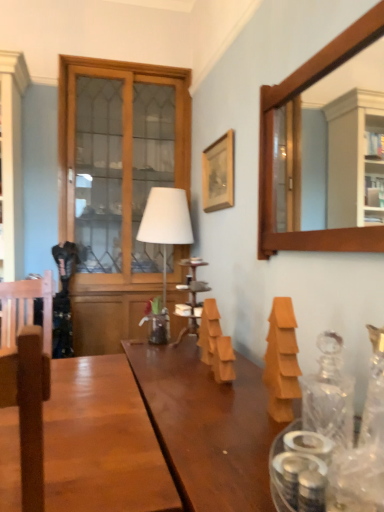
Where is `brown wood swivel chair at left`? This screenshot has width=384, height=512. brown wood swivel chair at left is located at coordinates [21, 330].

Find the location of a particular element. Image resolution: width=384 pixels, height=512 pixels. wooden frame mirror at upper right is located at coordinates (273, 142).

What is the approximate height of orange matte wooden blocks at center, the first wood positioned from the left?

orange matte wooden blocks at center, the first wood positioned from the left, is 9.26 inches in height.

This screenshot has height=512, width=384. What are the coordinates of `wooden cabinet with glass doors at left` in the screenshot? It's located at (119, 159).

What are the coordinates of `transparent glass decanter at right` in the screenshot? It's located at (329, 394).

Find the location of `brown wood swivel chair at left`. brown wood swivel chair at left is located at coordinates (21, 330).

Locate an element on the screen. the 1st wood in front when counting from the wooden cabinet with glass doors at left is located at coordinates (215, 344).

Does wooden cabinet with glass doors at left come behind orange matte wooden blocks at center, placed as the 1th wood when sorted from back to front?

Yes, it is.

From the image's perspective, would you say wooden cabinet with glass doors at left is shown under orange matte wooden blocks at center, the first wood positioned from the left?

Actually, wooden cabinet with glass doors at left appears above orange matte wooden blocks at center, the first wood positioned from the left, in the image.

Is point (64, 76) farther from viewer compared to point (229, 337)?

Yes, point (64, 76) is farther from viewer.

From a real-world perspective, is orange matte wooden blocks at center, the first wood positioned from the left, positioned under brown wood swivel chair at left based on gravity?

Incorrect, from a real-world perspective, orange matte wooden blocks at center, the first wood positioned from the left, is higher than brown wood swivel chair at left.

Between orange matte wooden blocks at center, placed as the 1th wood when sorted from back to front, and brown wood swivel chair at left, which one has more height?

brown wood swivel chair at left is taller.

Who is bigger, orange matte wooden blocks at center, acting as the 2th wood starting from the front, or brown wood swivel chair at left?

brown wood swivel chair at left is bigger.

Could brown wood swivel chair at left be considered to be inside orange matte wooden blocks at center, placed as the 1th wood when sorted from back to front?

No, brown wood swivel chair at left is located outside of orange matte wooden blocks at center, placed as the 1th wood when sorted from back to front.

Is point (213, 332) more distant than point (313, 415)?

Yes, it is behind point (313, 415).

Is orange matte wooden blocks at center, which is the 2th wood from right to left, further to camera compared to transparent glass decanter at right?

Yes, orange matte wooden blocks at center, which is the 2th wood from right to left, is behind transparent glass decanter at right.

In the scene shown: From the image's perspective, is orange matte wooden blocks at center, acting as the 2th wood starting from the front, over transparent glass decanter at right?

Yes, from the image's perspective, orange matte wooden blocks at center, acting as the 2th wood starting from the front, is over transparent glass decanter at right.

Considering the relative sizes of wooden cabinet with glass doors at left and transparent glass decanter at right in the image provided, is wooden cabinet with glass doors at left shorter than transparent glass decanter at right?

In fact, wooden cabinet with glass doors at left may be taller than transparent glass decanter at right.

Is wooden cabinet with glass doors at left positioned far away from transparent glass decanter at right?

Yes.

Does wooden cabinet with glass doors at left have a larger size compared to transparent glass decanter at right?

Yes, wooden cabinet with glass doors at left is bigger than transparent glass decanter at right.

Is white matte table lamp at center looking in the opposite direction of orange matte wooden blocks at center, placed as the 1th wood when sorted from back to front?

No.

Considering the relative positions of white matte table lamp at center and orange matte wooden blocks at center, acting as the 2th wood starting from the front, in the image provided, is white matte table lamp at center to the left or to the right of orange matte wooden blocks at center, acting as the 2th wood starting from the front,?

white matte table lamp at center is to the left of orange matte wooden blocks at center, acting as the 2th wood starting from the front.

Does point (149, 221) lie in front of point (228, 343)?

No.

Is white matte table lamp at center touching orange matte wooden blocks at center, the first wood positioned from the left?

No, white matte table lamp at center is not touching orange matte wooden blocks at center, the first wood positioned from the left.

Consider the image. Is clear glass vase at right facing away from orange matte wooden block at right, which appears as the 2th wood when viewed from the back?

clear glass vase at right does not have its back to orange matte wooden block at right, which appears as the 2th wood when viewed from the back.

From the image's perspective, which one is positioned higher, clear glass vase at right or orange matte wooden block at right, which ranks as the 1th wood in right-to-left order?

orange matte wooden block at right, which ranks as the 1th wood in right-to-left order, from the image's perspective.

Considering the relative positions of clear glass vase at right and orange matte wooden block at right, which appears as the 2th wood when viewed from the back, in the image provided, is clear glass vase at right behind orange matte wooden block at right, which appears as the 2th wood when viewed from the back,?

No, it is not.

What's the angular difference between clear glass vase at right and white matte table lamp at center's facing directions?

clear glass vase at right and white matte table lamp at center are facing 91.2 degrees away from each other.

Is clear glass vase at right placed right next to white matte table lamp at center?

clear glass vase at right and white matte table lamp at center are clearly separated.

Which is behind, point (377, 428) or point (172, 204)?

The point (172, 204) is behind.

Considering the relative positions of clear glass vase at right and white matte table lamp at center in the image provided, is clear glass vase at right to the left or to the right of white matte table lamp at center?

From the image, it's evident that clear glass vase at right is to the right of white matte table lamp at center.

Find the location of a particular element. window that is above the orange matte wooden blocks at center, which is the 2th wood from right to left (from the image's perspective) is located at coordinates (119, 159).

In order to click on swivel chair on the left of orange matte wooden blocks at center, which is the 2th wood from right to left in this screenshot , I will do `click(21, 330)`.

Which object lies nearer to the anchor point orange matte wooden blocks at center, placed as the 1th wood when sorted from back to front, brown wood swivel chair at left or clear glass vase at right?

Based on the image, clear glass vase at right appears to be nearer to orange matte wooden blocks at center, placed as the 1th wood when sorted from back to front.

From the picture: Based on their spatial positions, is orange matte wooden blocks at center, the first wood positioned from the left, or brown wood swivel chair at left closer to wooden cabinet with glass doors at left?

Among the two, brown wood swivel chair at left is located nearer to wooden cabinet with glass doors at left.

Based on their spatial positions, is orange matte wooden block at right, which ranks as the 1th wood in front-to-back order, or transparent glass decanter at right further from orange matte wooden blocks at center, which is the 2th wood from right to left?

transparent glass decanter at right lies further to orange matte wooden blocks at center, which is the 2th wood from right to left, than the other object.

Considering their positions, is transparent glass decanter at right positioned further to wooden picture frame at upper center than orange matte wooden blocks at center, acting as the 2th wood starting from the front?

transparent glass decanter at right.

Looking at the image, which one is located further to wooden frame mirror at upper right, wooden cabinet with glass doors at left or wooden picture frame at upper center?

wooden cabinet with glass doors at left.

From the image, which object appears to be farther from clear glass vase at right, brown wood swivel chair at left or wooden picture frame at upper center?

wooden picture frame at upper center.

Which object lies further to the anchor point orange matte wooden block at right, which appears as the 2th wood when viewed from the back, clear glass vase at right or orange matte wooden blocks at center, the first wood positioned from the left?

orange matte wooden blocks at center, the first wood positioned from the left.

From the image, which object appears to be nearer to wooden frame mirror at upper right, white matte table lamp at center or wooden picture frame at upper center?

The object closer to wooden frame mirror at upper right is wooden picture frame at upper center.

The image size is (384, 512). Identify the location of swivel chair between wooden frame mirror at upper right and wooden cabinet with glass doors at left in the front-back direction. (21, 330).

I want to click on glass jar between clear glass vase at right and white matte table lamp at center in the front-back direction, so click(x=329, y=394).

I want to click on wood between transparent glass decanter at right and orange matte wooden blocks at center, placed as the 1th wood when sorted from back to front, along the z-axis, so click(x=281, y=361).

You are a GUI agent. You are given a task and a screenshot of the screen. Output one action in this format:
    pyautogui.click(x=<x>, y=<y>)
    Task: Click on the glass jar located between clear glass vase at right and orange matte wooden block at right, which ranks as the 1th wood in right-to-left order, in the depth direction
    Image resolution: width=384 pixels, height=512 pixels.
    Given the screenshot: What is the action you would take?
    pyautogui.click(x=329, y=394)